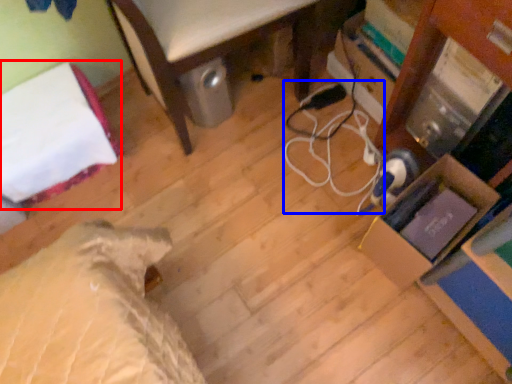
Question: Among these objects, which one is nearest to the camera, bed (highlighted by a red box) or cable (highlighted by a blue box)?

Choices:
 (A) bed
 (B) cable

Answer: (A)